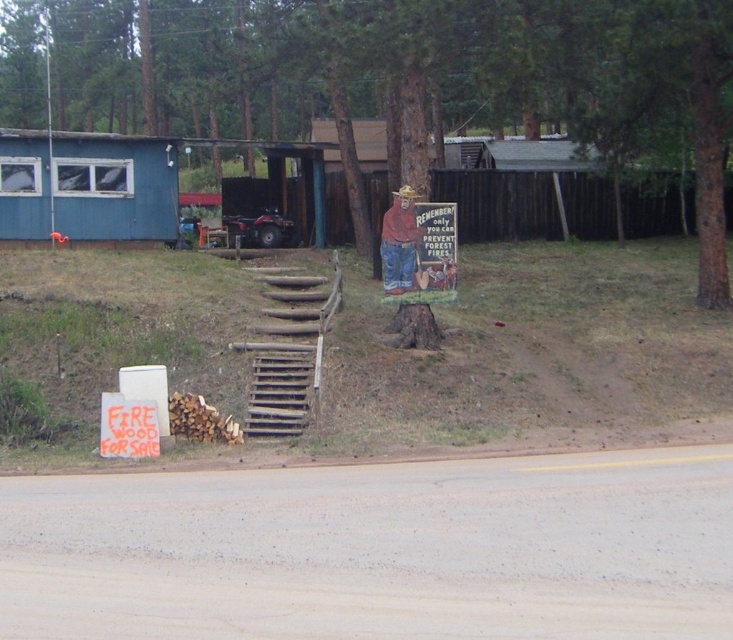
Is blue wooden hut at left taller than wooden stairs at center?

Yes, blue wooden hut at left is taller than wooden stairs at center.

Who is taller, blue wooden hut at left or wooden stairs at center?

With more height is blue wooden hut at left.

Describe the element at coordinates (86, 186) in the screenshot. The width and height of the screenshot is (733, 640). I see `blue wooden hut at left` at that location.

You are a GUI agent. You are given a task and a screenshot of the screen. Output one action in this format:
    pyautogui.click(x=<x>, y=<y>)
    Task: Click on the blue wooden hut at left
    Image resolution: width=733 pixels, height=640 pixels.
    Given the screenshot: What is the action you would take?
    pyautogui.click(x=86, y=186)

Is point (306, 298) less distant than point (122, 428)?

No, it is behind (122, 428).

Where is `wooden stairs at center`? This screenshot has width=733, height=640. wooden stairs at center is located at coordinates (290, 353).

Can you confirm if brown wood tree stump at center is wider than orange wood sign at lower left?

Yes, brown wood tree stump at center is wider than orange wood sign at lower left.

Is point (303, 44) behind point (141, 449)?

That is True.

Locate an element on the screen. brown wood tree stump at center is located at coordinates (397, 76).